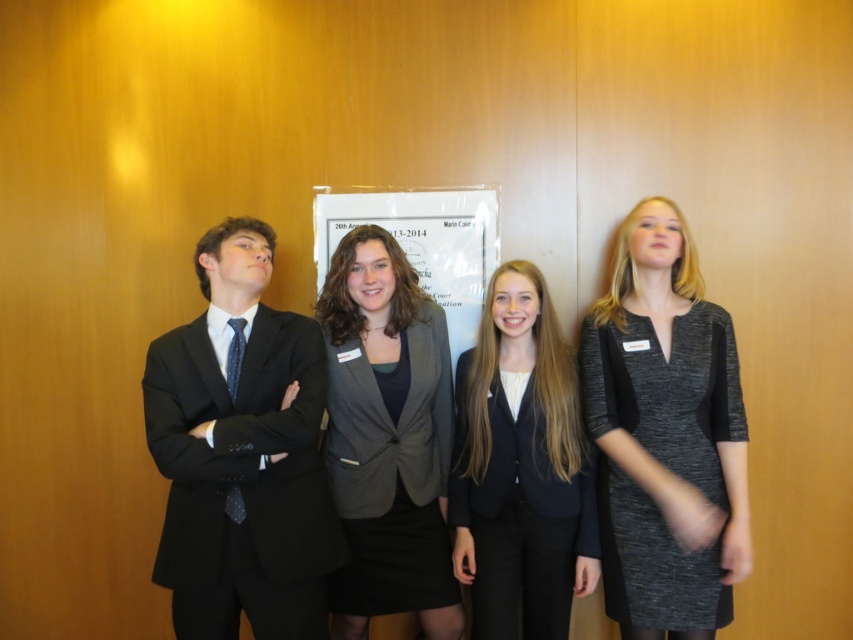
You are standing at the camera position and want to place a 2.5 meters long banner between you and the point at point (625, 621). Will the banner fit without bending?

The distance between you and the point at point (625, 621) is 2.05 meters, so the 2.5 meters banner is longer than the available space. The banner will not fit without bending.

You are taking a photo of the group and want to focus on the two points at the coordinates point (x=341, y=433) and point (x=491, y=422). Which point is closer to the camera?

Point (x=341, y=433) is further to the camera than point (x=491, y=422), so the closer point to the camera is point (x=491, y=422).